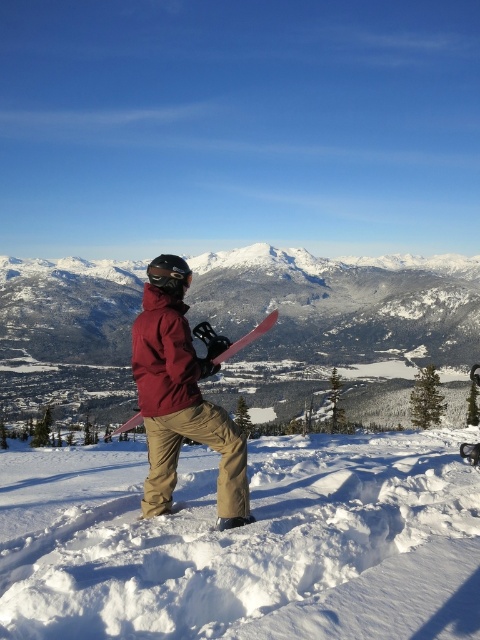
Question: Among these points, which one is nearest to the camera?

Choices:
 (A) (169, 269)
 (B) (283, 272)
 (C) (222, 355)

Answer: (A)

Question: Which of the following is the farthest from the observer?

Choices:
 (A) black matte goggles at center
 (B) snowy white mountain at center
 (C) white fluffy snow at center

Answer: (B)

Question: Is white fluffy snow at center further to the viewer compared to black matte goggles at center?

Choices:
 (A) yes
 (B) no

Answer: (B)

Question: Can you confirm if white fluffy snow at center is smaller than pink matte snowboard at center?

Choices:
 (A) no
 (B) yes

Answer: (B)

Question: Which object is farther from the camera taking this photo?

Choices:
 (A) black matte goggles at center
 (B) pink matte snowboard at center

Answer: (B)

Question: Is snowy white mountain at center to the left of pink matte snowboard at center from the viewer's perspective?

Choices:
 (A) no
 (B) yes

Answer: (A)